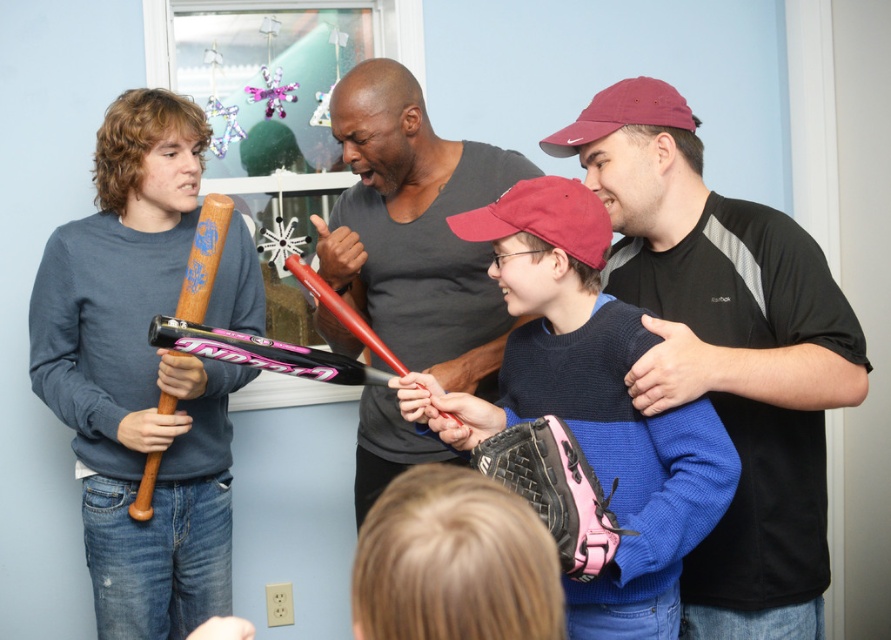
You are organizing a sports equipment sale and need to determine if the pink leather baseball glove at lower center can fit into a storage box designed for the red matte baseball cap at center. Based on their sizes, will it fit?

The pink leather baseball glove at lower center is larger in size compared to the red matte baseball cap at center, so it will not fit into the storage box designed for the red matte baseball cap at center.

Consider the image. You are standing in the room and want to hand the pink leather baseball glove at lower center to the person wearing the red matte baseball cap at center. Can you directly hand it to them without moving either object?

The pink leather baseball glove at lower center is to the right of the red matte baseball cap at center, so you can directly hand it to them without moving either object since they are positioned next to each other.

You are standing in the room and want to pick up the pink leather baseball glove at lower center. Based on the coordinates provided in the Objects Description, can you estimate its position relative to the window in the background?

The pink leather baseball glove at lower center is located at coordinates point (556,490). Since the window is in the background, the glove is closer to the front of the room compared to the window.